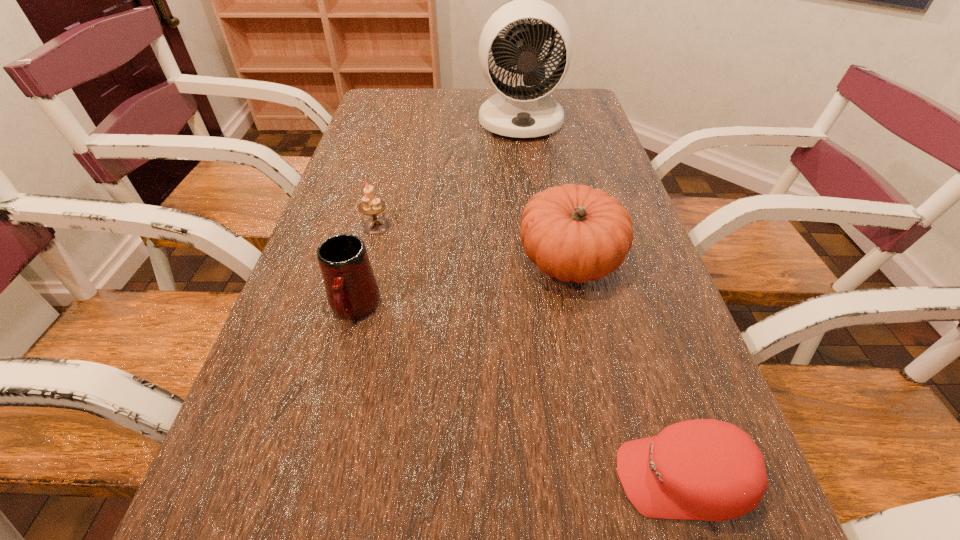
Locate an element on the screen. vacant space that is in between the candle holder and the pumpkin is located at coordinates (473, 244).

Where is `free spot between the nearest object and the tallest object`? The image size is (960, 540). free spot between the nearest object and the tallest object is located at coordinates (601, 300).

Identify the location of free space between the nearest object and the mug. The width and height of the screenshot is (960, 540). (518, 394).

The width and height of the screenshot is (960, 540). I want to click on unoccupied area between the fan and the mug, so click(438, 215).

You are a GUI agent. You are given a task and a screenshot of the screen. Output one action in this format:
    pyautogui.click(x=<x>, y=<y>)
    Task: Click on the free spot between the fourth tallest object and the fan
    The image size is (960, 540).
    Given the screenshot: What is the action you would take?
    tap(448, 174)

This screenshot has width=960, height=540. In order to click on object that can be found as the second closest to the pumpkin in this screenshot , I will do `click(704, 469)`.

Identify which object is located as the third nearest to the second shortest object. Please provide its 2D coordinates. Your answer should be formatted as a tuple, i.e. [(x, y)], where the tuple contains the x and y coordinates of a point satisfying the conditions above.

[(520, 111)]